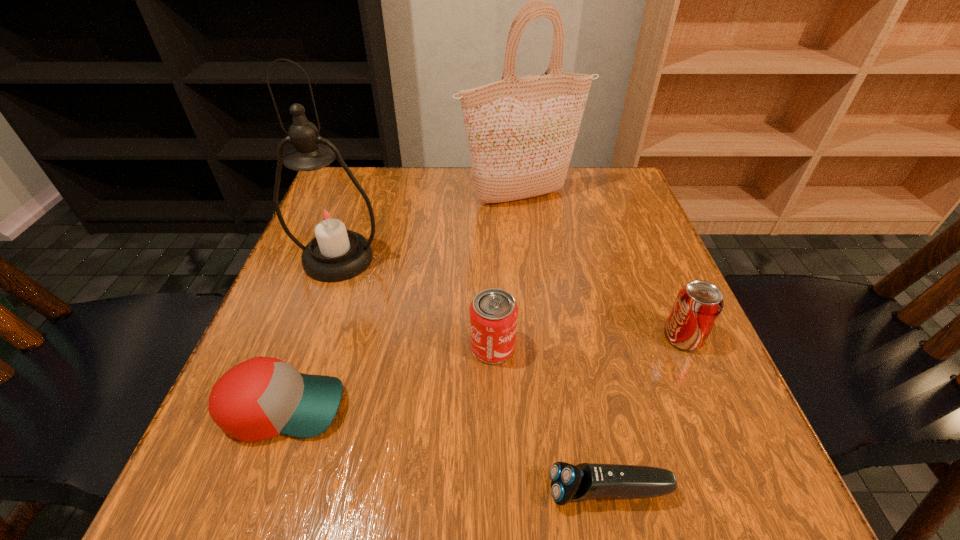
The image size is (960, 540). In order to click on shopping bag that is at the right edge in this screenshot , I will do `click(521, 132)`.

At what (x,y) coordinates should I click in order to perform the action: click on soda can that is at the right edge. Please return your answer as a coordinate pair (x, y). Looking at the image, I should click on (698, 305).

You are a GUI agent. You are given a task and a screenshot of the screen. Output one action in this format:
    pyautogui.click(x=<x>, y=<y>)
    Task: Click on the electric shaver that is at the right edge
    This screenshot has width=960, height=540.
    Given the screenshot: What is the action you would take?
    pyautogui.click(x=569, y=483)

Where is `object located in the far right corner section of the desktop`? This screenshot has height=540, width=960. object located in the far right corner section of the desktop is located at coordinates (521, 132).

At what (x,y) coordinates should I click in order to perform the action: click on object that is at the near right corner. Please return your answer as a coordinate pair (x, y). Looking at the image, I should click on (569, 483).

Image resolution: width=960 pixels, height=540 pixels. In the image, there is a desktop. In order to click on free region at the far edge in this screenshot , I will do click(x=453, y=184).

In the image, there is a desktop. Identify the location of vacant space at the near edge. (549, 455).

You are a GUI agent. You are given a task and a screenshot of the screen. Output one action in this format:
    pyautogui.click(x=<x>, y=<y>)
    Task: Click on the vacant space at the left edge of the desktop
    The width and height of the screenshot is (960, 540).
    Given the screenshot: What is the action you would take?
    pyautogui.click(x=306, y=292)

This screenshot has width=960, height=540. I want to click on vacant space at the right edge of the desktop, so click(x=630, y=322).

At what (x,y) coordinates should I click in order to perform the action: click on free spot at the far right corner of the desktop. Please return your answer as a coordinate pair (x, y). The height and width of the screenshot is (540, 960). Looking at the image, I should click on (637, 218).